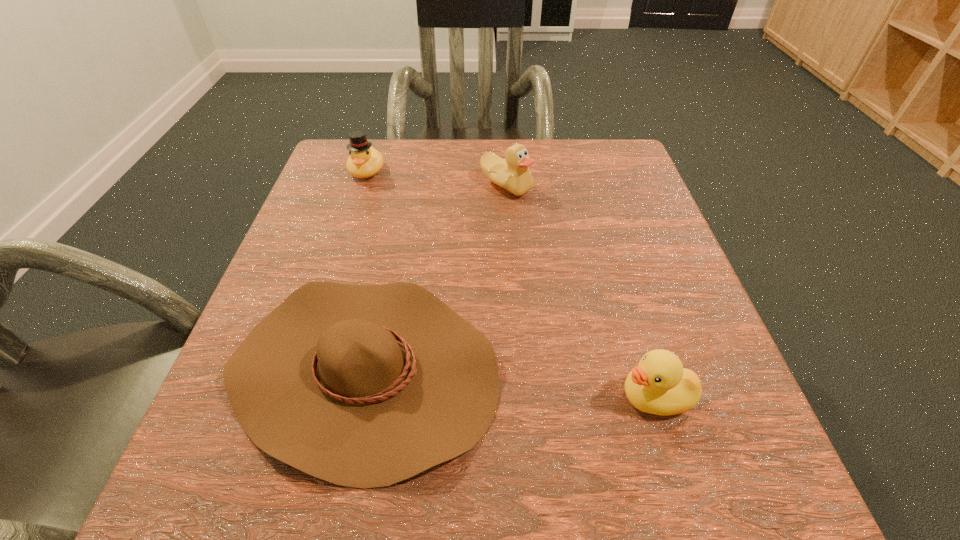
Locate an element on the screen. the second duck from right to left is located at coordinates (512, 174).

You are a GUI agent. You are given a task and a screenshot of the screen. Output one action in this format:
    pyautogui.click(x=<x>, y=<y>)
    Task: Click on the leftmost duck
    This screenshot has width=960, height=540.
    Given the screenshot: What is the action you would take?
    pyautogui.click(x=364, y=161)

This screenshot has height=540, width=960. Identify the location of the nearest duck. (659, 385).

Find the location of a particular element. This screenshot has height=540, width=960. the rightmost object is located at coordinates (659, 385).

The height and width of the screenshot is (540, 960). In order to click on the shortest object in this screenshot , I will do `click(364, 386)`.

Where is `vacant space located at the beak of the second duck from right to left`? The width and height of the screenshot is (960, 540). vacant space located at the beak of the second duck from right to left is located at coordinates (516, 327).

Find the location of a particular element. Image resolution: width=960 pixels, height=540 pixels. free location located on the front-facing side of the leftmost duck is located at coordinates (348, 227).

Where is `free spot located 0.100m at the beak of the nearest duck`? The height and width of the screenshot is (540, 960). free spot located 0.100m at the beak of the nearest duck is located at coordinates (545, 397).

Where is `free space located 0.250m at the beak of the nearest duck`? free space located 0.250m at the beak of the nearest duck is located at coordinates (437, 397).

Find the location of a particular element. vacant area situated 0.200m at the beak of the nearest duck is located at coordinates (473, 397).